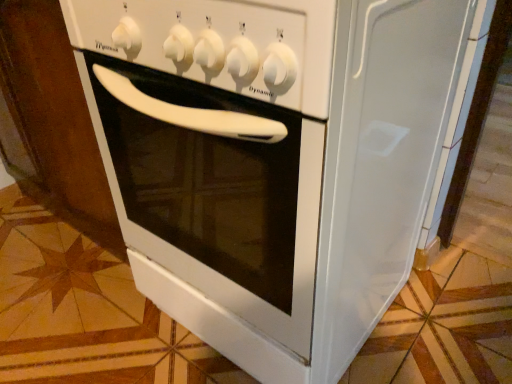
What is the approximate width of white glossy oven at center?

The width of white glossy oven at center is 25.00 inches.

What is the approximate height of white glossy oven at center?

It is 12.68 centimeters.

This screenshot has width=512, height=384. Describe the element at coordinates (219, 43) in the screenshot. I see `white glossy oven at center` at that location.

Identify the location of white glossy oven at center. (219, 43).

The image size is (512, 384). I want to click on white glossy oven at center, so click(219, 43).